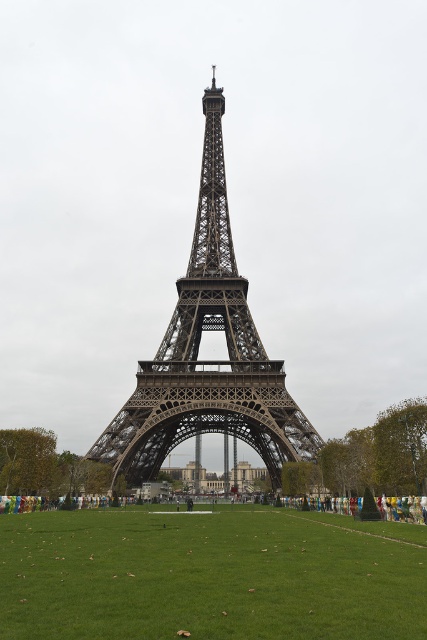
Does green grass at center appear on the left side of dark gray metal eiffel tower at center?

Indeed, green grass at center is positioned on the left side of dark gray metal eiffel tower at center.

Is green grass at center in front of dark gray metal eiffel tower at center?

That is True.

Which is in front, point (292, 580) or point (242, 420)?

Point (292, 580)

This screenshot has width=427, height=640. I want to click on green grass at center, so click(204, 577).